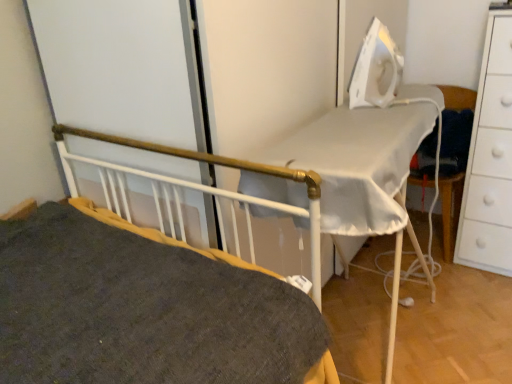
This screenshot has width=512, height=384. What do you see at coordinates (198, 190) in the screenshot?
I see `dark gray fabric bed at center` at bounding box center [198, 190].

Locate an element on the screen. This screenshot has width=512, height=384. white matte chest of drawers at right is located at coordinates (490, 157).

Are dark gray fabric bed at center and white fabric chair at right beside each other?

No.

From the image's perspective, which is above, dark gray fabric bed at center or white fabric chair at right?

white fabric chair at right is shown above in the image.

Does point (120, 138) come farther from viewer compared to point (452, 87)?

No, (120, 138) is closer to viewer.

Considering the relative positions of dark gray fabric bed at center and white fabric chair at right in the image provided, is dark gray fabric bed at center in front of white fabric chair at right?

Yes, it is.

Looking at this image, is white plastic iron at upper right turned away from dark gray fabric bed at center?

white plastic iron at upper right does not have its back to dark gray fabric bed at center.

From a real-world perspective, is white plastic iron at upper right positioned over dark gray fabric bed at center based on gravity?

Yes, from a real-world perspective, white plastic iron at upper right is over dark gray fabric bed at center

Is white plastic iron at upper right outside of dark gray fabric bed at center?

white plastic iron at upper right is positioned outside dark gray fabric bed at center.

Is white plastic iron at upper right closer to camera compared to dark gray fabric bed at center?

No, it is behind dark gray fabric bed at center.

Can you confirm if white fabric chair at right is shorter than white matte chest of drawers at right?

Indeed, white fabric chair at right has a lesser height compared to white matte chest of drawers at right.

From a real-world perspective, does white fabric chair at right stand above white matte chest of drawers at right?

No.

Is white fabric chair at right inside or outside of white matte chest of drawers at right?

white fabric chair at right cannot be found inside white matte chest of drawers at right.

Is point (452, 99) farther from viewer compared to point (508, 57)?

Yes, point (452, 99) is farther from viewer.

Based on their sizes in the image, would you say white matte chest of drawers at right is bigger or smaller than white fabric chair at right?

white matte chest of drawers at right is bigger than white fabric chair at right.

In the scene shown: Is white matte chest of drawers at right facing towards white fabric chair at right?

No, white matte chest of drawers at right does not turn towards white fabric chair at right.

Considering the relative positions of white matte chest of drawers at right and dark gray fabric bed at center in the image provided, is white matte chest of drawers at right in front of dark gray fabric bed at center?

No, it is not.

Is point (487, 227) positioned before point (283, 176)?

No, (487, 227) is further to viewer.

Between white matte chest of drawers at right and dark gray fabric bed at center, which one appears on the left side from the viewer's perspective?

From the viewer's perspective, dark gray fabric bed at center appears more on the left side.

Can you tell me how much white matte chest of drawers at right and dark gray fabric bed at center differ in facing direction?

The facing directions of white matte chest of drawers at right and dark gray fabric bed at center are 91.1 degrees apart.

Is dark gray fabric bed at center with white plastic iron at upper right?

No, dark gray fabric bed at center is not in contact with white plastic iron at upper right.

Which object is wider, dark gray fabric bed at center or white plastic iron at upper right?

Wider between the two is dark gray fabric bed at center.

From a real-world perspective, is dark gray fabric bed at center physically below white plastic iron at upper right?

Yes, from a real-world perspective, dark gray fabric bed at center is under white plastic iron at upper right.

Is white fabric chair at right further to camera compared to dark gray fabric bed at center?

Yes, the depth of white fabric chair at right is greater than that of dark gray fabric bed at center.

Is white fabric chair at right thinner than dark gray fabric bed at center?

Indeed, white fabric chair at right has a lesser width compared to dark gray fabric bed at center.

From the image's perspective, between white fabric chair at right and dark gray fabric bed at center, who is located below?

dark gray fabric bed at center.

Is white fabric chair at right bigger or smaller than dark gray fabric bed at center?

white fabric chair at right is smaller than dark gray fabric bed at center.

This screenshot has width=512, height=384. Identify the location of chair on the right of dark gray fabric bed at center. (448, 212).

Locate an element on the screen. bed below the white plastic iron at upper right (from the image's perspective) is located at coordinates (198, 190).

From the image, which object appears to be nearer to white fabric chair at right, white matte chest of drawers at right or dark gray fabric bed at center?

white matte chest of drawers at right lies closer to white fabric chair at right than the other object.

Estimate the real-world distances between objects in this image. Which object is further from dark gray fabric bed at center, white matte chest of drawers at right or white plastic iron at upper right?

white matte chest of drawers at right lies further to dark gray fabric bed at center than the other object.

Based on their spatial positions, is white fabric chair at right or white plastic iron at upper right further from white matte chest of drawers at right?

The object further to white matte chest of drawers at right is white plastic iron at upper right.

Based on their spatial positions, is white matte chest of drawers at right or dark gray fabric bed at center closer to white plastic iron at upper right?

dark gray fabric bed at center.

Estimate the real-world distances between objects in this image. Which object is further from dark gray fabric bed at center, white plastic iron at upper right or white fabric chair at right?

white fabric chair at right.

Looking at the image, which one is located closer to white matte chest of drawers at right, dark gray fabric bed at center or white fabric chair at right?

The object closer to white matte chest of drawers at right is white fabric chair at right.

Estimate the real-world distances between objects in this image. Which object is further from white plastic iron at upper right, white fabric chair at right or dark gray fabric bed at center?

Among the two, white fabric chair at right is located further to white plastic iron at upper right.

Looking at the image, which one is located closer to dark gray fabric bed at center, white matte chest of drawers at right or white fabric chair at right?

white fabric chair at right is closer to dark gray fabric bed at center.

Identify the location of equipment positioned between dark gray fabric bed at center and white fabric chair at right from near to far. The height and width of the screenshot is (384, 512). (376, 69).

I want to click on chair between white plastic iron at upper right and white matte chest of drawers at right in the horizontal direction, so click(x=448, y=212).

Find the location of `chair between dark gray fabric bed at center and white matte chest of drawers at right in the horizontal direction`. chair between dark gray fabric bed at center and white matte chest of drawers at right in the horizontal direction is located at coordinates (448, 212).

Locate an element on the screen. The height and width of the screenshot is (384, 512). equipment between dark gray fabric bed at center and white matte chest of drawers at right is located at coordinates click(x=376, y=69).